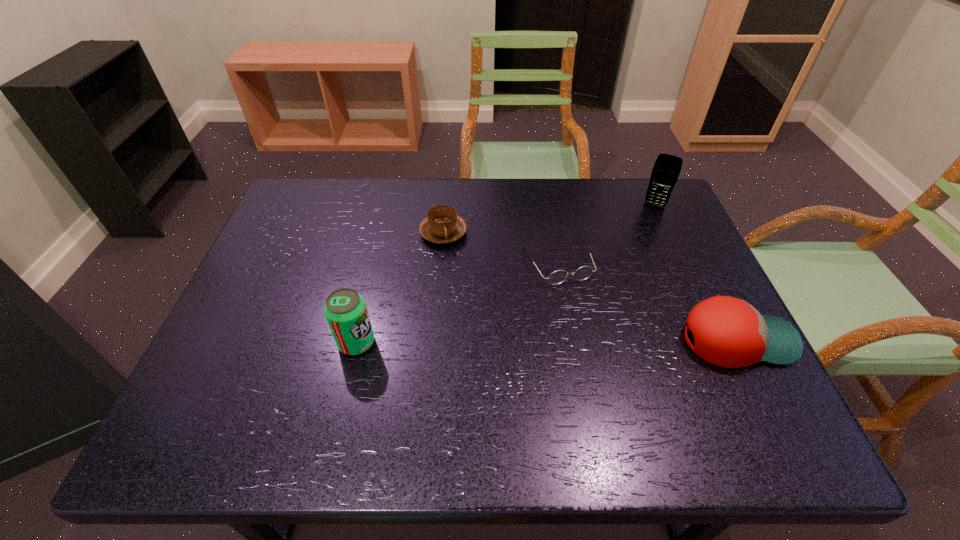
Where is `vacant spot on the desktop that is between the leftmost object and the baseball cap and is positioned on the side of the fourth tallest object with the handle`? This screenshot has height=540, width=960. vacant spot on the desktop that is between the leftmost object and the baseball cap and is positioned on the side of the fourth tallest object with the handle is located at coordinates (540, 341).

Locate an element on the screen. vacant space on the desktop that is between the leftmost object and the third shortest object and is positioned on the screen of the farthest object is located at coordinates (603, 341).

Where is `free spot on the desktop that is between the leftmost object and the third shortest object and is positioned through the lenses of the third object from left to right`? The width and height of the screenshot is (960, 540). free spot on the desktop that is between the leftmost object and the third shortest object and is positioned through the lenses of the third object from left to right is located at coordinates (596, 341).